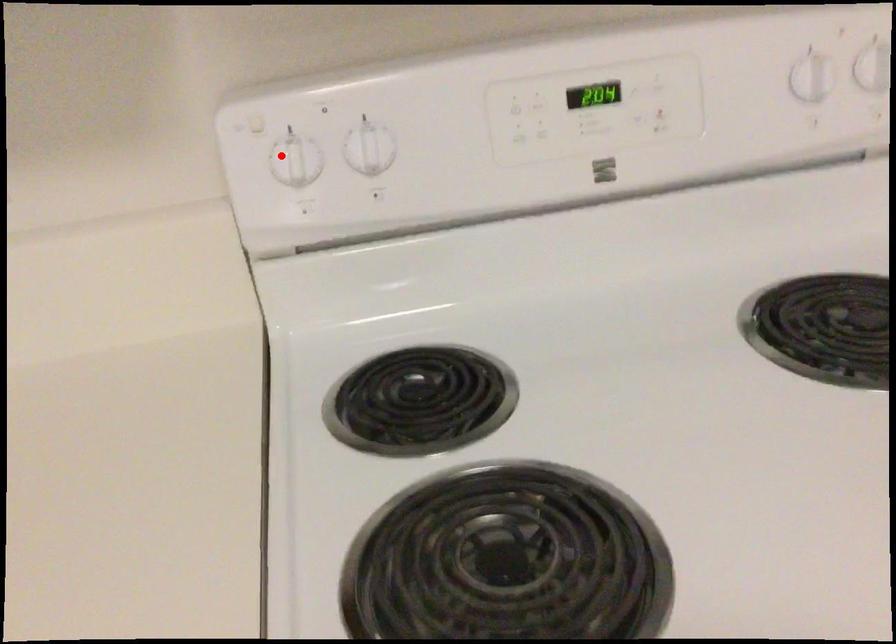
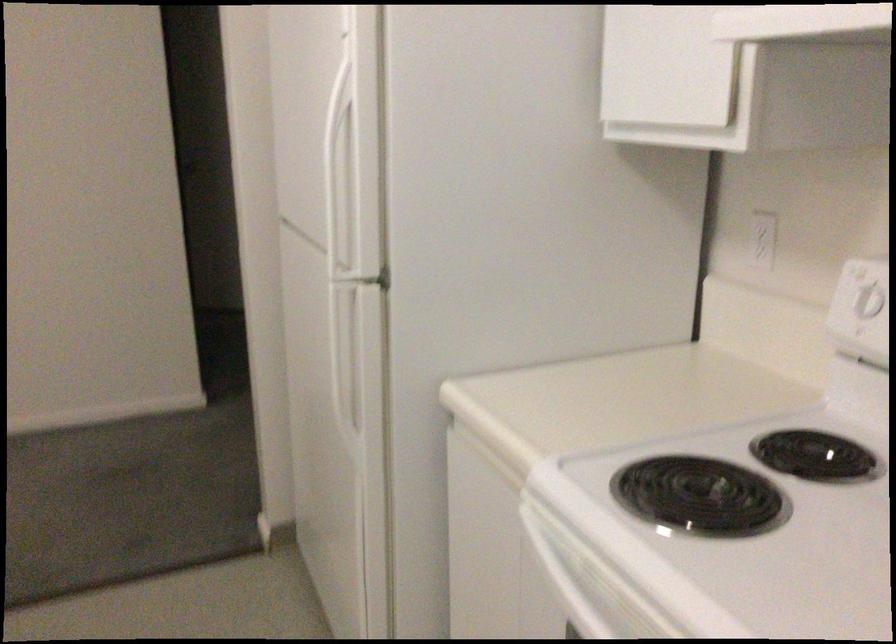
Question: A red point is marked in image1. In image2, is the corresponding 3D point closer to the camera or farther? Reply with the corresponding letter.

Choices:
 (A) The corresponding 3D point is closer.
 (B) The corresponding 3D point is farther.

Answer: (B)